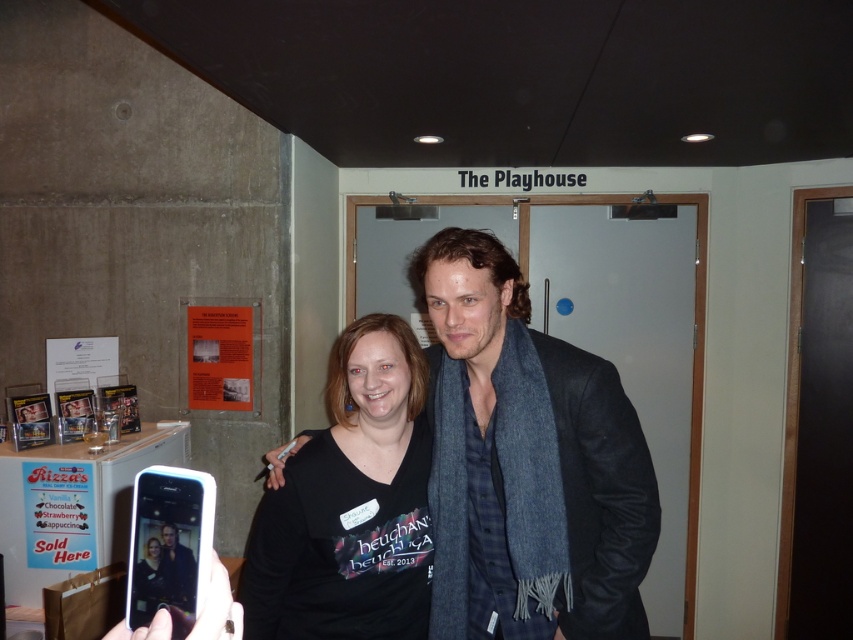
Does dark gray wool scarf at center have a larger size compared to black matte shirt at center?

Correct, dark gray wool scarf at center is larger in size than black matte shirt at center.

Does dark gray wool scarf at center appear over black matte shirt at center?

Correct, dark gray wool scarf at center is located above black matte shirt at center.

Who is more distant from viewer, (461, 442) or (238, 586)?

The point (238, 586) is behind.

This screenshot has width=853, height=640. I want to click on dark gray wool scarf at center, so click(526, 464).